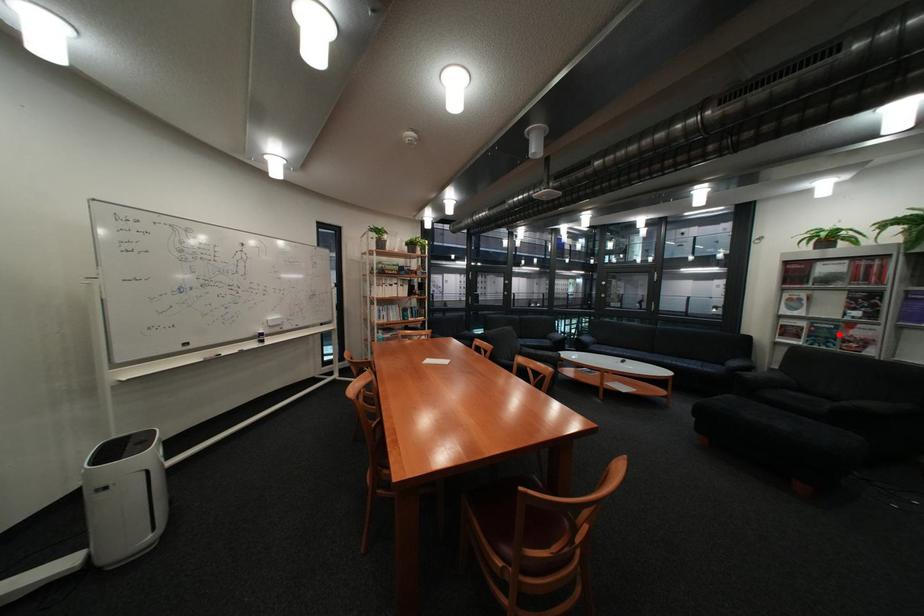
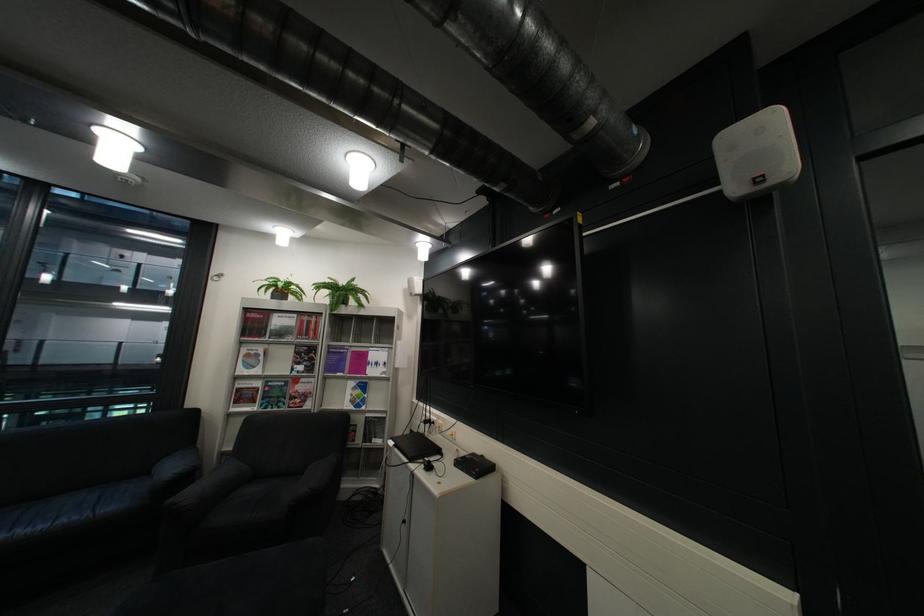
Where in the second image is the point corresponding to the highlighted location from the first image?

(290, 394)